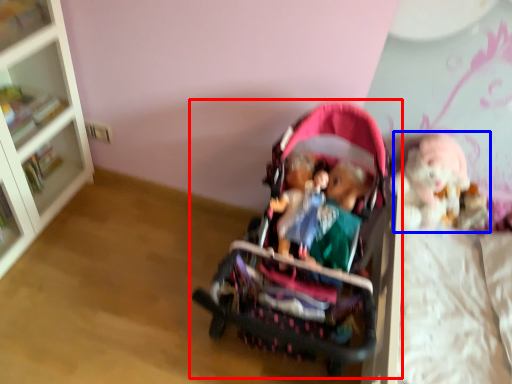
Question: Which of the following is the closest to the observer, toy (highlighted by a red box) or doll (highlighted by a blue box)?

Choices:
 (A) toy
 (B) doll

Answer: (A)